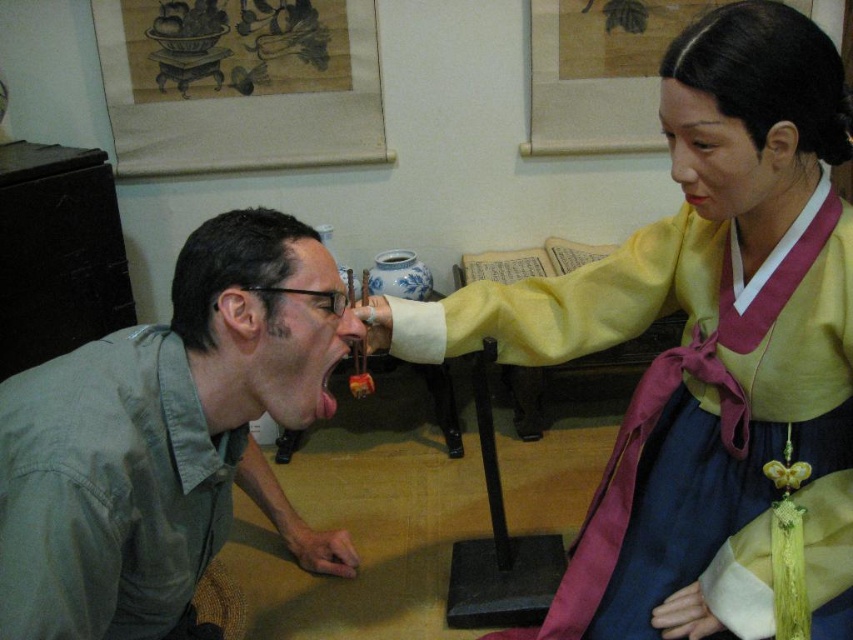
Is matte yellow fabric at upper right to the right of green cotton shirt at lower left from the viewer's perspective?

Indeed, matte yellow fabric at upper right is positioned on the right side of green cotton shirt at lower left.

Between point (761, 204) and point (51, 572), which one is positioned behind?

Positioned behind is point (761, 204).

Which is in front, point (730, 230) or point (22, 388)?

Positioned in front is point (22, 388).

Where is `matte yellow fabric at upper right`? matte yellow fabric at upper right is located at coordinates (703, 346).

Which of these two, matte yellow fabric at upper right or green matte shirt at lower left, stands taller?

matte yellow fabric at upper right

Which is more to the right, matte yellow fabric at upper right or green matte shirt at lower left?

Positioned to the right is matte yellow fabric at upper right.

Identify the location of matte yellow fabric at upper right. (703, 346).

Does green matte shirt at lower left have a lesser height compared to green cotton shirt at lower left?

Incorrect, green matte shirt at lower left's height does not fall short of green cotton shirt at lower left's.

The height and width of the screenshot is (640, 853). What are the coordinates of `green matte shirt at lower left` in the screenshot? It's located at (167, 436).